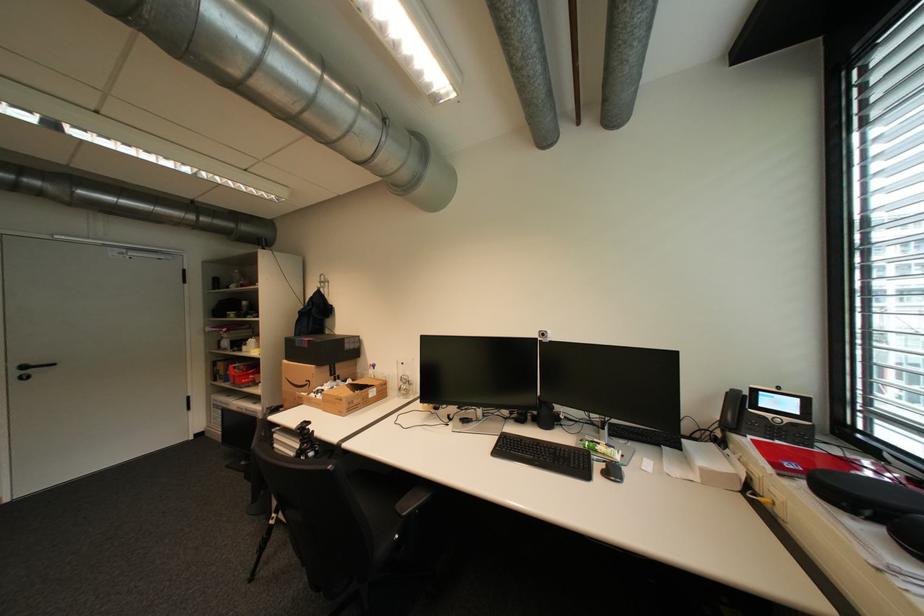
You are a GUI agent. You are given a task and a screenshot of the screen. Output one action in this format:
    pyautogui.click(x=<x>, y=<y>)
    Task: Click on the black chair armrest
    This screenshot has height=616, width=924.
    Given the screenshot: What is the action you would take?
    [x=339, y=524]